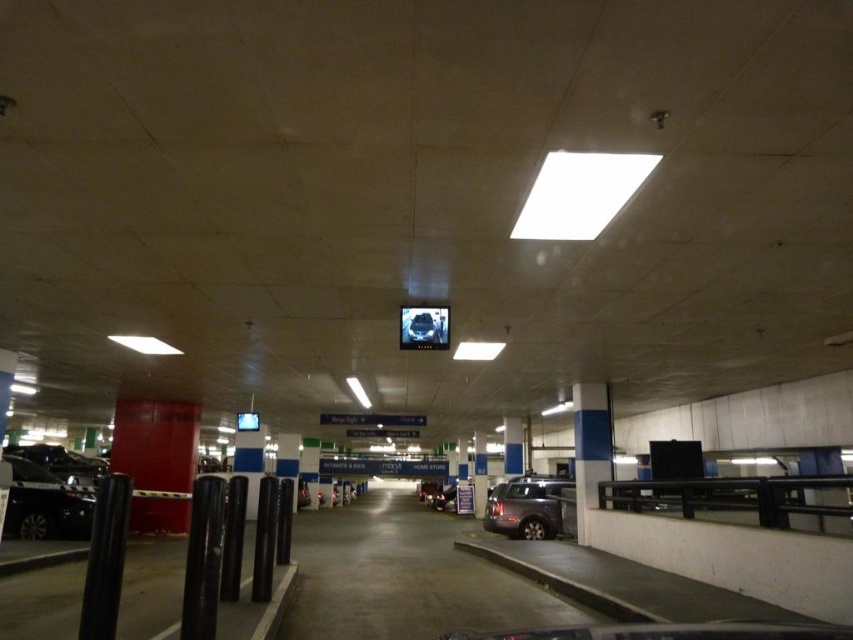
You are a delivery driver who needs to park your truck, which is 2 meters wide, in this parking garage. There are two SUVs in the way at the center. Which SUV, the metallic silver suv at center or the metallic gray suv at center, should you move to have enough space for your truck?

The metallic silver suv at center is thinner than the metallic gray suv at center, so you should move the metallic silver suv at center to create enough space for your truck since it occupies less width.

You are standing at the entrance of the parking garage and see the point marked at coordinates (45, 504). What object is located at that point?

The point at coordinates (45, 504) corresponds to the shiny black car at lower left.